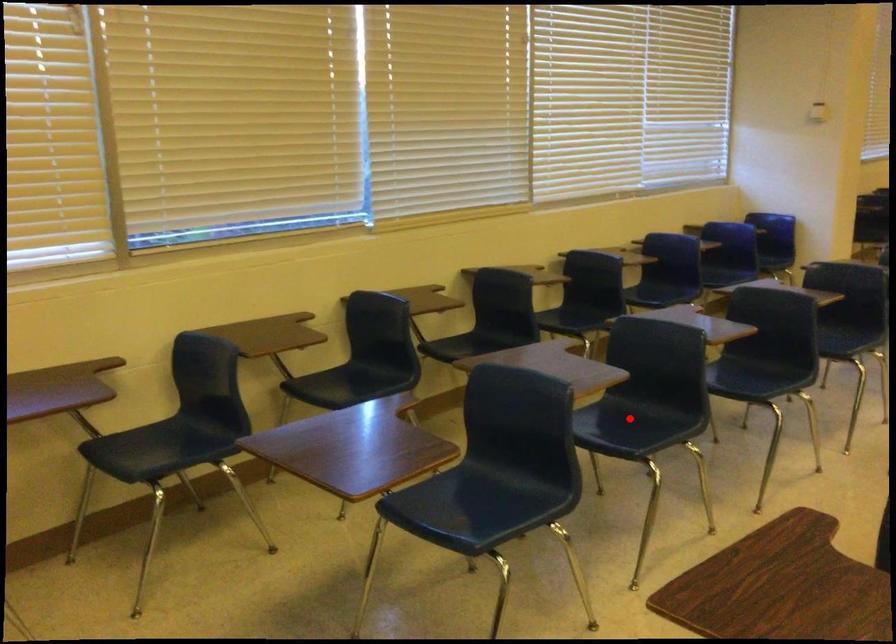
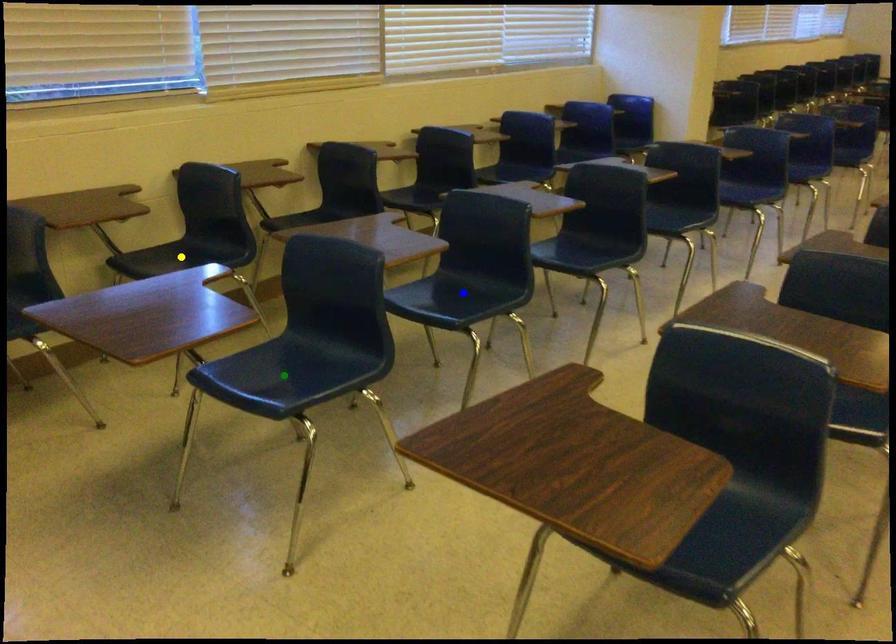
Question: I am providing you with two images of the same scene from different viewpoints. A red point is marked on the first image. You are given multiple points on the second image. In image 2, which mark is for the same physical point as the one in image 1?

Choices:
 (A) blue point
 (B) green point
 (C) yellow point

Answer: (A)